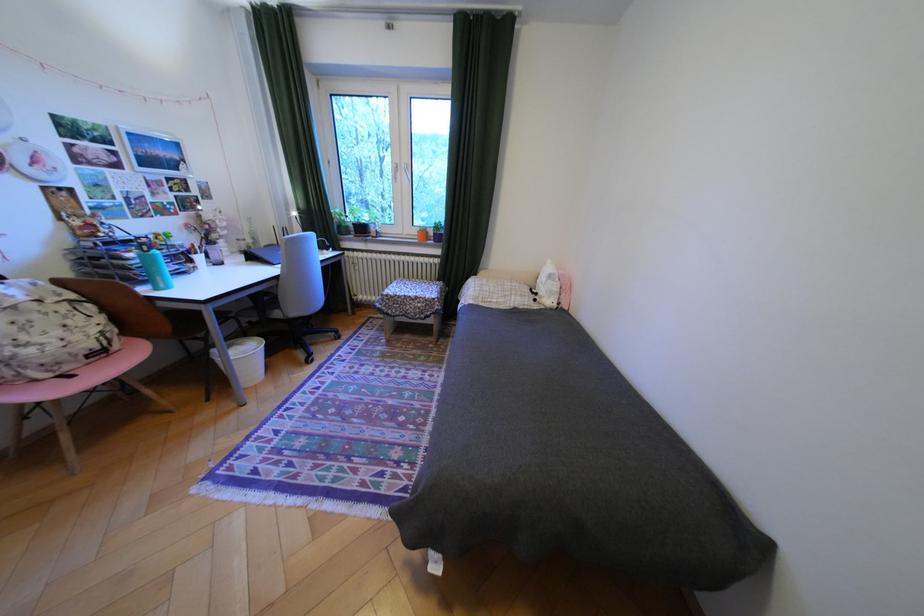
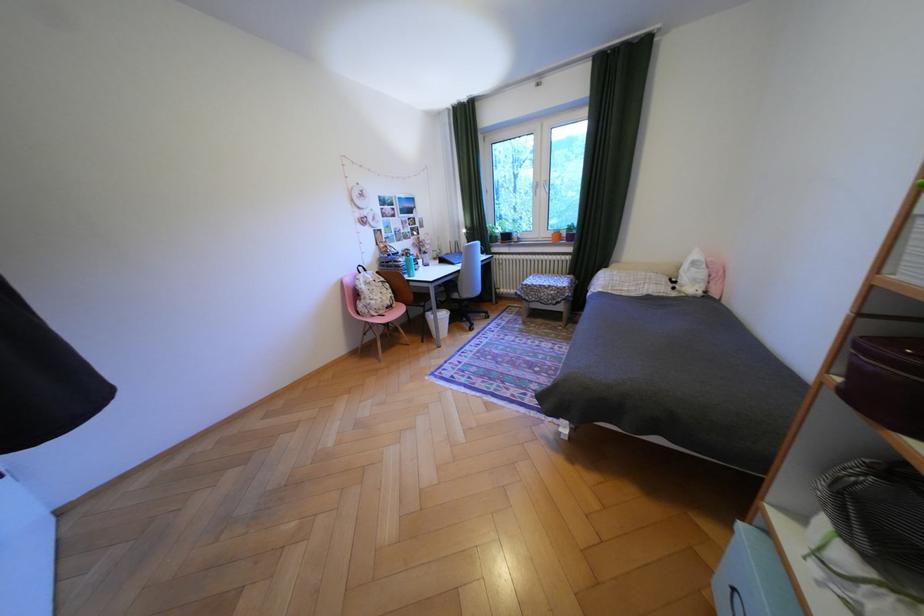
Find the pixel in the second image that matches point (429, 297) in the first image.

(562, 286)